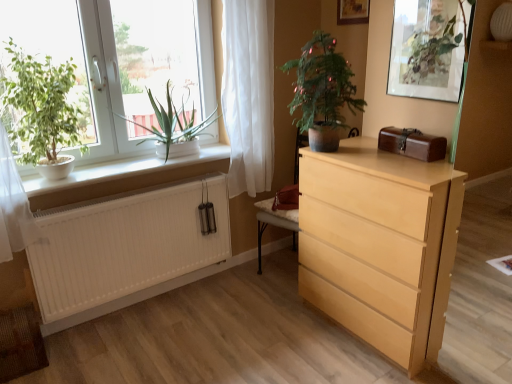
Question: Considering the relative sizes of green leafy plant at left, which is the second houseplant in left-to-right order, and white matte radiator at lower left in the image provided, is green leafy plant at left, which is the second houseplant in left-to-right order, wider than white matte radiator at lower left?

Choices:
 (A) no
 (B) yes

Answer: (B)

Question: Are green leafy plant at left, which is the second houseplant in left-to-right order, and white matte radiator at lower left making contact?

Choices:
 (A) yes
 (B) no

Answer: (B)

Question: Is green leafy plant at left, the 2th houseplant from the right, at the right side of white matte radiator at lower left?

Choices:
 (A) no
 (B) yes

Answer: (B)

Question: Is green leafy plant at left, which is the second houseplant in left-to-right order, oriented away from white matte radiator at lower left?

Choices:
 (A) yes
 (B) no

Answer: (B)

Question: Can we say green leafy plant at left, the 2th houseplant from the right, lies outside white matte radiator at lower left?

Choices:
 (A) yes
 (B) no

Answer: (A)

Question: Considering the relative sizes of green leafy plant at left, which is the second houseplant in left-to-right order, and white matte radiator at lower left in the image provided, is green leafy plant at left, which is the second houseplant in left-to-right order, shorter than white matte radiator at lower left?

Choices:
 (A) no
 (B) yes

Answer: (B)

Question: Is brown leather box at upper right completely or partially outside of white plastic window at left?

Choices:
 (A) no
 (B) yes

Answer: (B)

Question: Is brown leather box at upper right facing away from white plastic window at left?

Choices:
 (A) yes
 (B) no

Answer: (B)

Question: From the image's perspective, is brown leather box at upper right located above white plastic window at left?

Choices:
 (A) no
 (B) yes

Answer: (A)

Question: From a real-world perspective, is brown leather box at upper right positioned under white plastic window at left based on gravity?

Choices:
 (A) yes
 (B) no

Answer: (A)

Question: Does brown leather box at upper right have a greater height compared to white plastic window at left?

Choices:
 (A) yes
 (B) no

Answer: (B)

Question: Is brown leather box at upper right beside white plastic window at left?

Choices:
 (A) yes
 (B) no

Answer: (B)

Question: Is green matte plant at left, the first houseplant viewed from the left, at the back of white matte window sill at left?

Choices:
 (A) yes
 (B) no

Answer: (B)